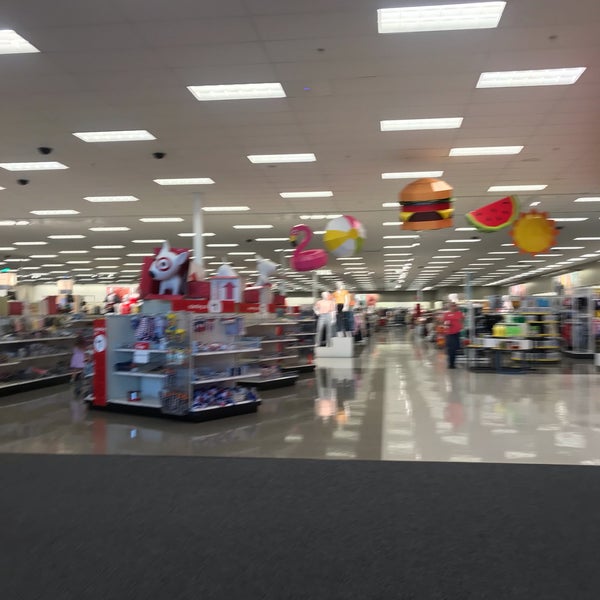
Identify the location of square lights. The image size is (600, 600). (248, 92).